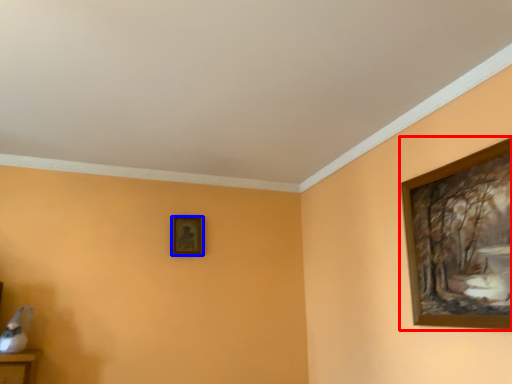
Question: Which of the following is the closest to the observer, picture frame (highlighted by a red box) or picture frame (highlighted by a blue box)?

Choices:
 (A) picture frame
 (B) picture frame

Answer: (A)